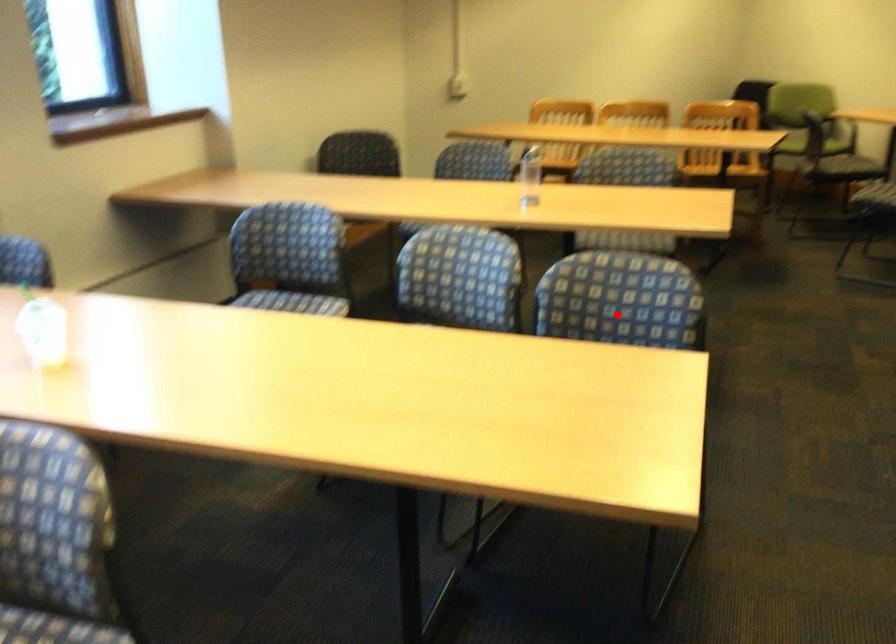
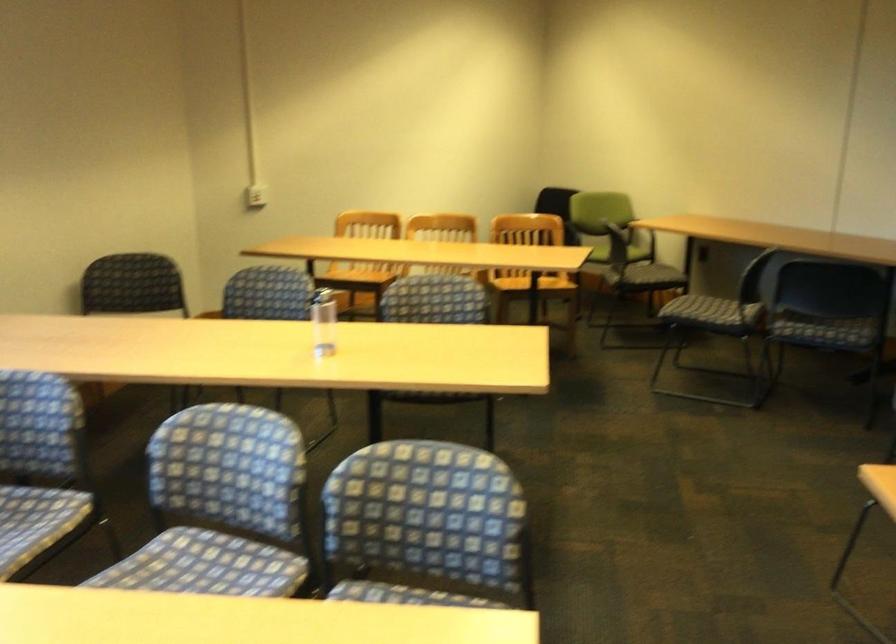
Find the pixel in the second image that matches the highlighted location in the first image.

(425, 527)